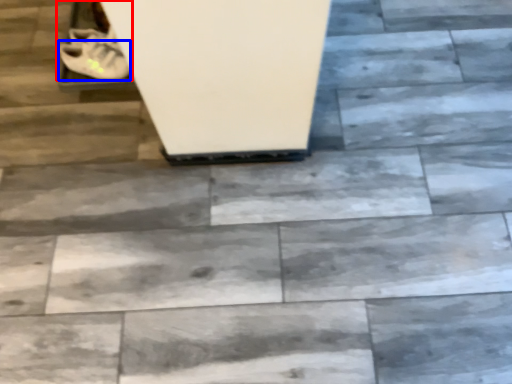
Question: Which object is closer to the camera taking this photo, footwear (highlighted by a red box) or shoe (highlighted by a blue box)?

Choices:
 (A) footwear
 (B) shoe

Answer: (B)